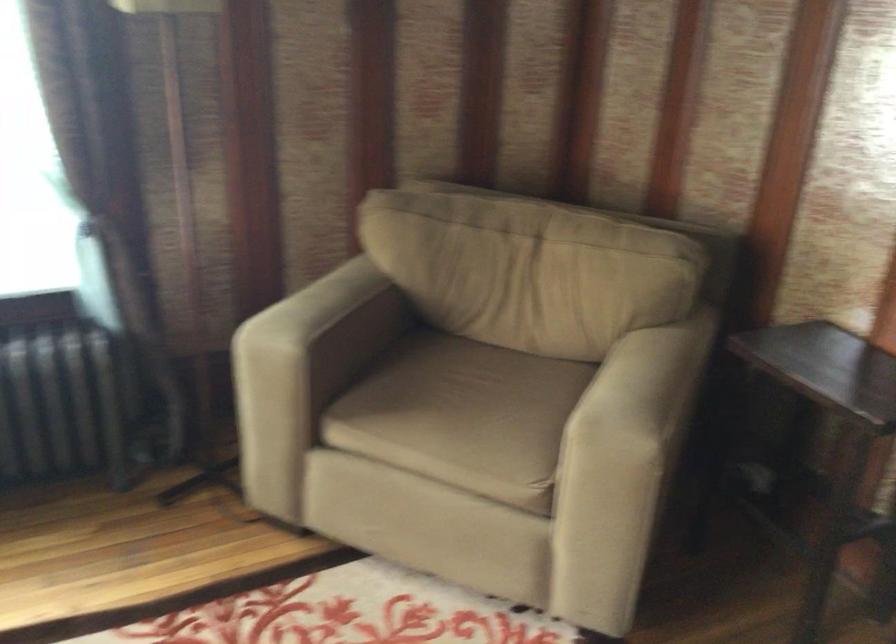
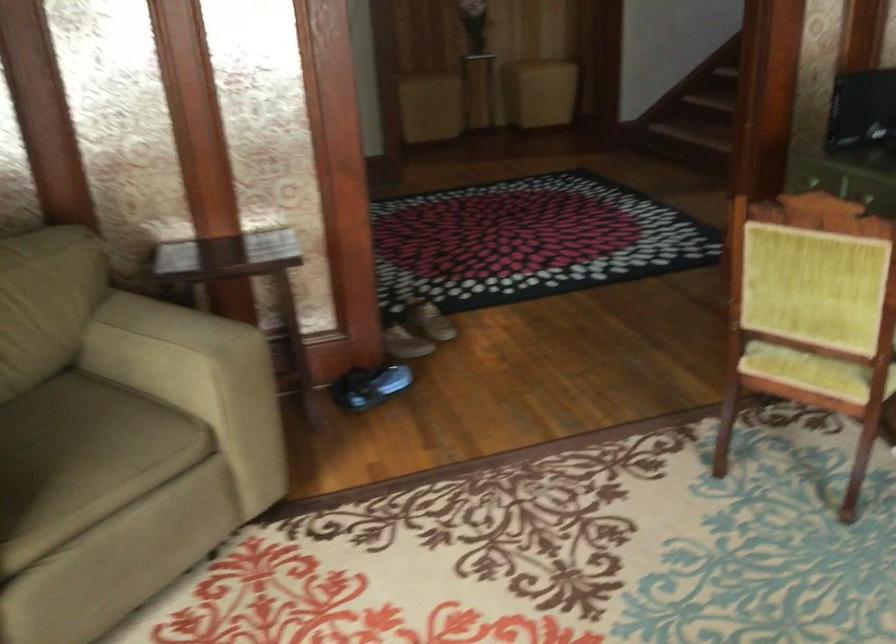
The point at (444,420) is marked in the first image. Where is the corresponding point in the second image?

(82, 459)